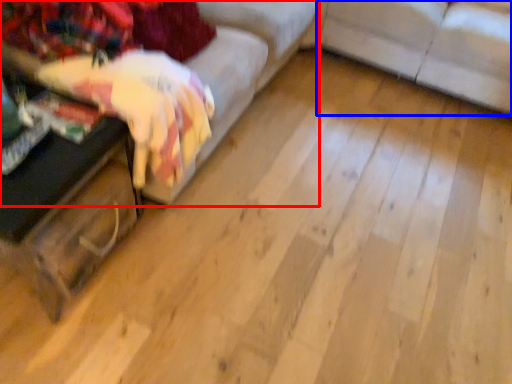
Question: Among these objects, which one is farthest to the camera, studio couch (highlighted by a red box) or studio couch (highlighted by a blue box)?

Choices:
 (A) studio couch
 (B) studio couch

Answer: (B)